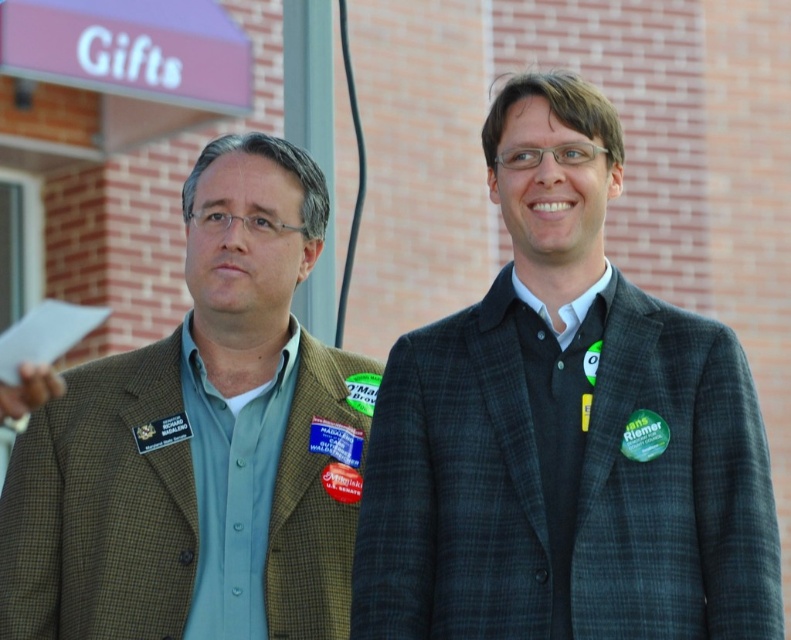
Question: Which point is farther to the camera?

Choices:
 (A) green plaid blazer at left
 (B) plaid wool blazer at center

Answer: (A)

Question: Is plaid wool blazer at center below green plaid blazer at left?

Choices:
 (A) yes
 (B) no

Answer: (B)

Question: Can you confirm if plaid wool blazer at center is wider than green plaid blazer at left?

Choices:
 (A) yes
 (B) no

Answer: (B)

Question: Which object is closer to the camera taking this photo?

Choices:
 (A) plaid wool blazer at center
 (B) green plaid blazer at left

Answer: (A)

Question: Is plaid wool blazer at center behind green plaid blazer at left?

Choices:
 (A) no
 (B) yes

Answer: (A)